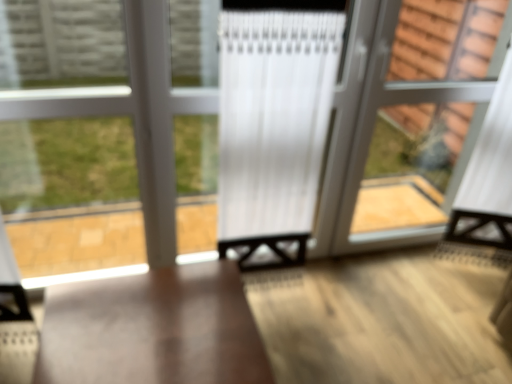
Question: Based on their positions, is clear glass bay window at left located to the left or right of matte wood table at center?

Choices:
 (A) right
 (B) left

Answer: (B)

Question: Considering the positions of clear glass bay window at left and matte wood table at center in the image, is clear glass bay window at left taller or shorter than matte wood table at center?

Choices:
 (A) short
 (B) tall

Answer: (B)

Question: Which object is the closest to the clear glass bay window at left?

Choices:
 (A) matte wood table at center
 (B) clear glass screen door at right

Answer: (A)

Question: Which object is the farthest from the clear glass bay window at left?

Choices:
 (A) matte wood table at center
 (B) clear glass screen door at right

Answer: (B)